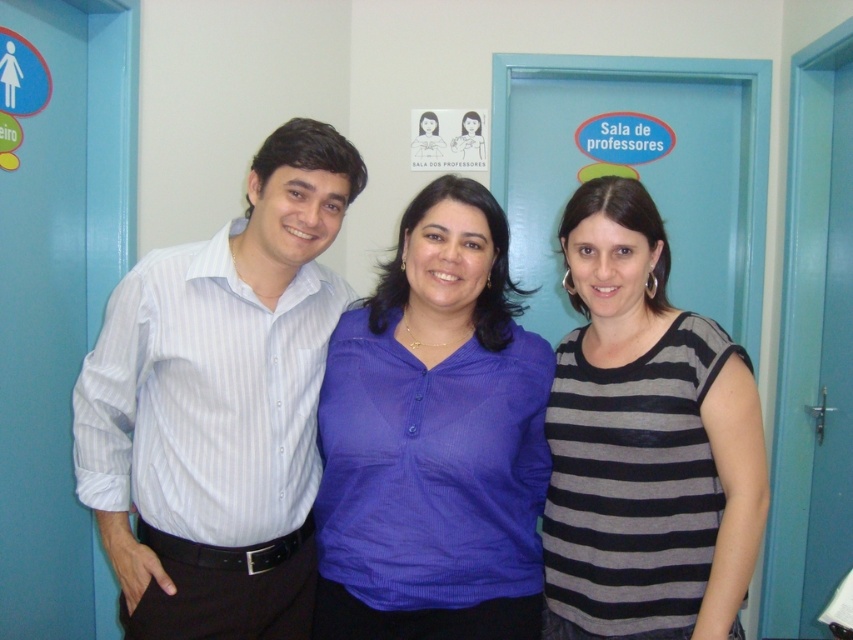
What do you see at coordinates (219, 404) in the screenshot?
I see `white striped shirt at center` at bounding box center [219, 404].

Can you confirm if white striped shirt at center is taller than striped cotton shirt at right?

Yes, white striped shirt at center is taller than striped cotton shirt at right.

Is point (276, 528) farther from camera compared to point (730, 440)?

Yes, it is behind point (730, 440).

Find the location of a particular element. The image size is (853, 640). white striped shirt at center is located at coordinates (219, 404).

Between point (122, 564) and point (354, 445), which one is positioned in front?

Point (354, 445)

Where is `white striped shirt at center`? The width and height of the screenshot is (853, 640). white striped shirt at center is located at coordinates (219, 404).

Who is more distant from viewer, (252, 358) or (489, 282)?

The point (489, 282) is more distant.

Locate an element on the screen. This screenshot has height=640, width=853. white striped shirt at center is located at coordinates (219, 404).

Does matte blue blouse at center lie in front of striped cotton shirt at right?

Yes.

Between matte blue blouse at center and striped cotton shirt at right, which one has more height?

striped cotton shirt at right

Does point (509, 448) come farther from viewer compared to point (628, 320)?

No.

I want to click on matte blue blouse at center, so click(x=433, y=440).